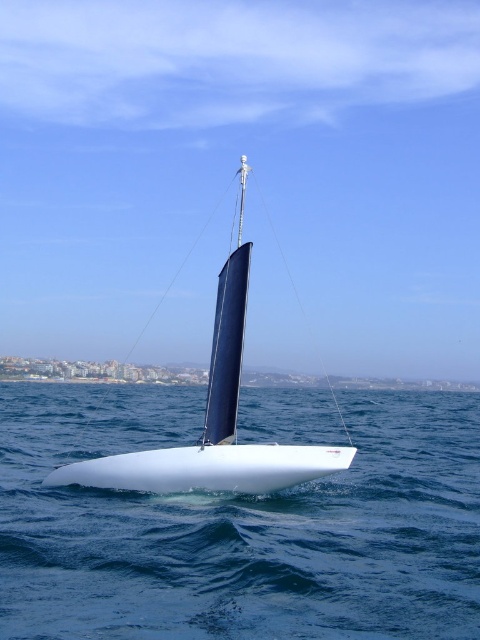
Question: In this image, where is white smooth water at center located relative to blue glossy sail at center?

Choices:
 (A) above
 (B) below

Answer: (B)

Question: Which object is closer to the camera taking this photo?

Choices:
 (A) white smooth water at center
 (B) blue glossy sail at center

Answer: (A)

Question: Can you confirm if white smooth water at center is positioned to the right of blue glossy sail at center?

Choices:
 (A) no
 (B) yes

Answer: (B)

Question: Is white smooth water at center thinner than blue glossy sail at center?

Choices:
 (A) yes
 (B) no

Answer: (B)